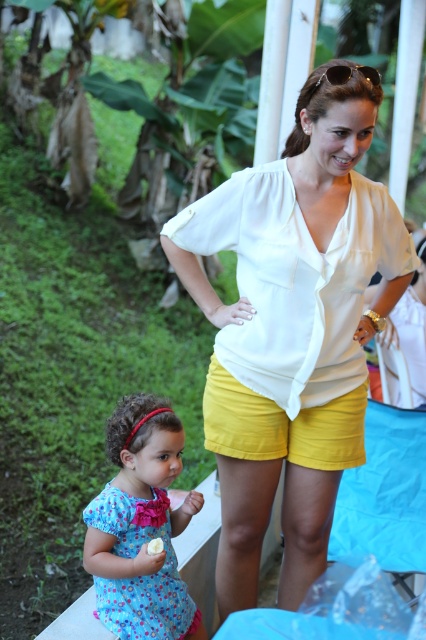
Question: Which point is closer to the camera taking this photo?

Choices:
 (A) (253, 404)
 (B) (152, 506)

Answer: (B)

Question: Can you confirm if white silky blouse at center is smaller than yellow cotton shorts at center?

Choices:
 (A) no
 (B) yes

Answer: (A)

Question: From the image, what is the correct spatial relationship of white silky blouse at center in relation to blue floral dress at lower left?

Choices:
 (A) below
 (B) above

Answer: (B)

Question: Is the position of white silky blouse at center more distant than that of blue floral dress at lower left?

Choices:
 (A) no
 (B) yes

Answer: (A)

Question: Which point is farther to the camera?

Choices:
 (A) (149, 552)
 (B) (313, 452)

Answer: (B)

Question: Which point appears closest to the camera in this image?

Choices:
 (A) (207, 420)
 (B) (327, 218)

Answer: (B)